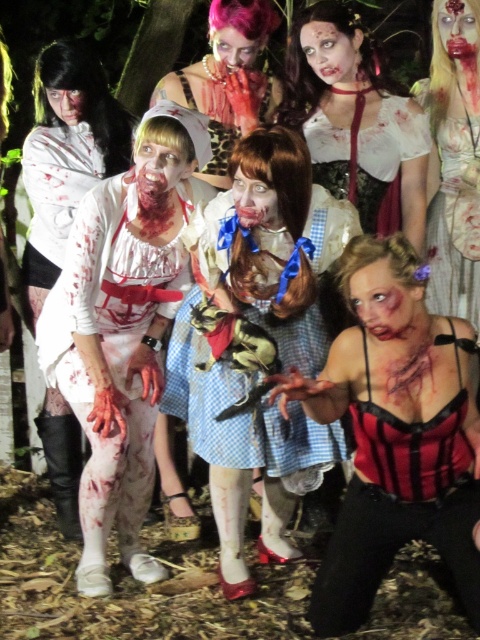
Does point (186, 259) come behind point (440, 10)?

No.

Which is behind, point (64, 275) or point (476, 72)?

The point (476, 72) is more distant.

The height and width of the screenshot is (640, 480). I want to click on white lace apron at left, so click(109, 332).

Between white lace apron at left and shiny pink wig at upper center, which one appears on the left side from the viewer's perspective?

Positioned to the left is white lace apron at left.

Locate an element on the screen. This screenshot has height=640, width=480. white lace apron at left is located at coordinates (109, 332).

Find the location of a particular element. white lace apron at left is located at coordinates (109, 332).

Does point (229, 275) come closer to viewer compared to point (308, 20)?

Yes, point (229, 275) is closer to viewer.

Is blue plaid dress at center below matte white blouse at upper center?

Correct, blue plaid dress at center is located below matte white blouse at upper center.

Is point (175, 358) positioned before point (373, 195)?

Yes.

The image size is (480, 640). In order to click on blue plaid dress at center in this screenshot , I will do `click(240, 413)`.